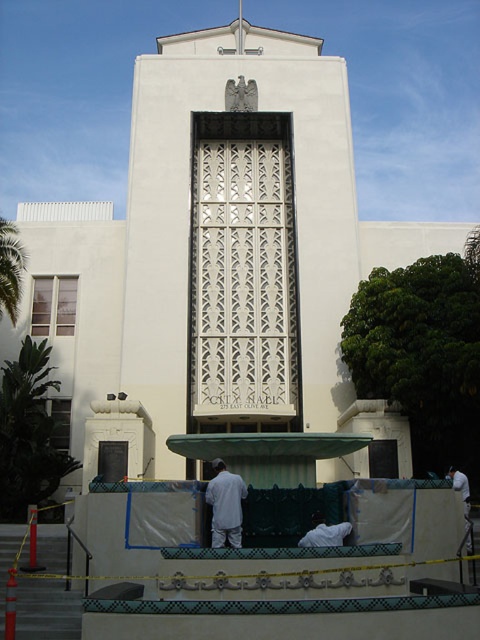
Question: Can you confirm if white cotton shirt at center is smaller than white fabric at lower right?

Choices:
 (A) no
 (B) yes

Answer: (B)

Question: Can you confirm if white cotton shirt at center is smaller than white fabric at lower right?

Choices:
 (A) yes
 (B) no

Answer: (A)

Question: Is white cotton shirt at center thinner than white fabric at lower right?

Choices:
 (A) yes
 (B) no

Answer: (A)